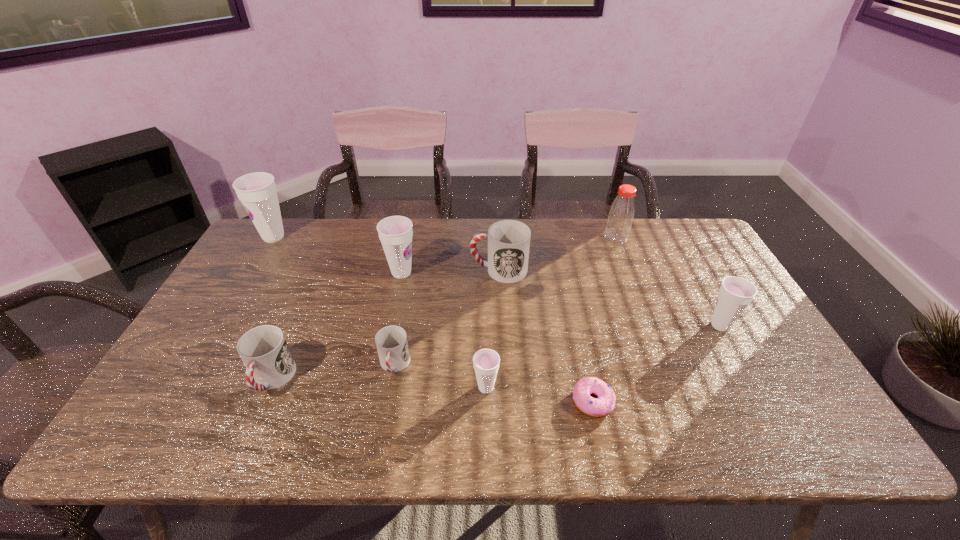
This screenshot has width=960, height=540. In order to click on the closest cup to the second object from left to right in this screenshot , I will do `click(391, 341)`.

Locate an element on the screen. This screenshot has height=540, width=960. the closest purple cup to the third purple cup from left to right is located at coordinates (395, 232).

Locate an element on the screen. The height and width of the screenshot is (540, 960). purple cup that is the third closest to the leftmost object is located at coordinates (735, 294).

You are a GUI agent. You are given a task and a screenshot of the screen. Output one action in this format:
    pyautogui.click(x=<x>, y=<y>)
    Task: Click on the red cup that can be found as the closest to the biggest red cup
    Image resolution: width=960 pixels, height=540 pixels.
    Given the screenshot: What is the action you would take?
    pyautogui.click(x=391, y=341)

Identify the location of the third closest red cup relative to the red bottle. The height and width of the screenshot is (540, 960). (264, 350).

Identify the location of blank area in the image that satisfies the following two spatial constraints: 1. on the side of the second red cup from right to left where the handle is located; 2. on the left side of the pink doughnut. Image resolution: width=960 pixels, height=540 pixels. (388, 401).

Where is `vacant region that satisfies the following two spatial constraints: 1. on the front side of the farthest purple cup; 2. on the left side of the red bottle`? The image size is (960, 540). vacant region that satisfies the following two spatial constraints: 1. on the front side of the farthest purple cup; 2. on the left side of the red bottle is located at coordinates (273, 238).

Image resolution: width=960 pixels, height=540 pixels. In order to click on vacant point that satisfies the following two spatial constraints: 1. on the front side of the shortest object; 2. on the right side of the third purple cup from left to right in this screenshot , I will do `click(486, 401)`.

At what (x,y) coordinates should I click in order to perform the action: click on vacant position in the image that satisfies the following two spatial constraints: 1. on the side of the second object from left to right where the handle is located; 2. on the left side of the smallest purple cup. Please return your answer as a coordinate pair (x, y). Looking at the image, I should click on (269, 388).